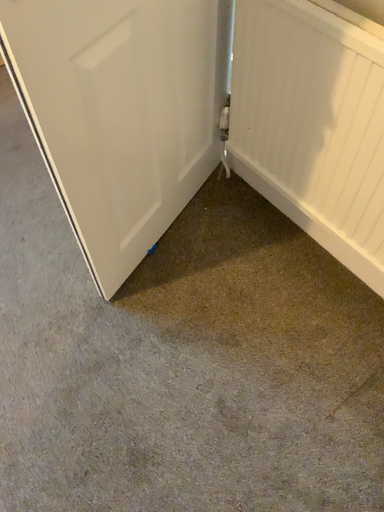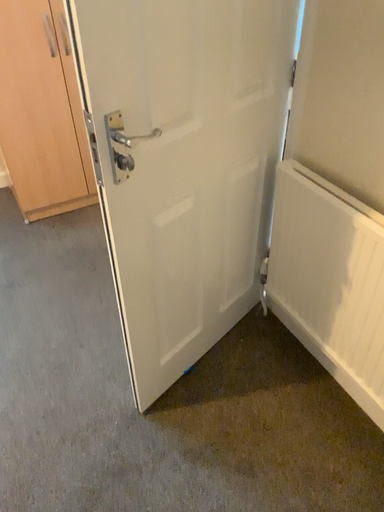
Question: How did the camera likely rotate when shooting the video?

Choices:
 (A) rotated upward
 (B) rotated downward

Answer: (A)